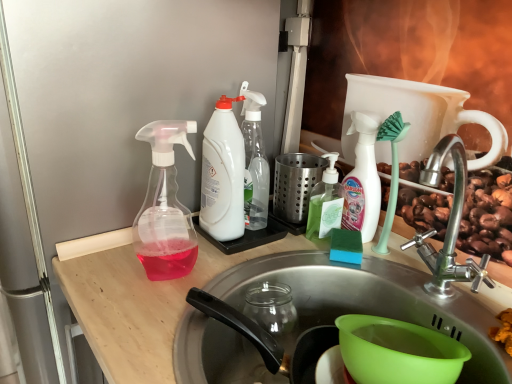
This screenshot has height=384, width=512. In order to click on vacant area that is in front of transparent plastic spray bottle at left, acting as the 5th bottle starting from the right in this screenshot , I will do `click(145, 320)`.